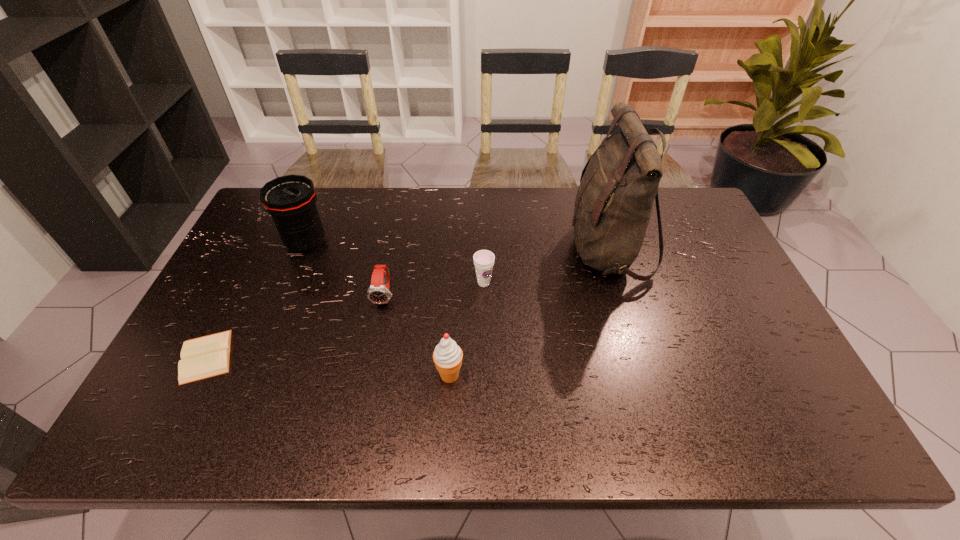
This screenshot has height=540, width=960. In order to click on unoccupied area between the cup and the tallest object in this screenshot , I will do `click(546, 267)`.

The image size is (960, 540). What are the coordinates of `vacant space in between the fourth shortest object and the third object from left to right` in the screenshot? It's located at (418, 335).

Identify the location of vacant space in between the fourth object from right to left and the fifth object from left to right. (435, 289).

The image size is (960, 540). Find the location of `vacant space in between the watch and the telephoto lens`. vacant space in between the watch and the telephoto lens is located at coordinates (346, 269).

Locate an element on the screen. empty space between the fourth object from left to right and the watch is located at coordinates (418, 335).

Image resolution: width=960 pixels, height=540 pixels. I want to click on the second closest object to the telephoto lens, so click(208, 356).

Choose which object is the third nearest neighbor to the shortest object. Please provide its 2D coordinates. Your answer should be formatted as a tuple, i.e. [(x, y)], where the tuple contains the x and y coordinates of a point satisfying the conditions above.

[(447, 356)]

You are a GUI agent. You are given a task and a screenshot of the screen. Output one action in this format:
    pyautogui.click(x=<x>, y=<y>)
    Task: Click on the vacant area that satisfies the following two spatial constraints: 1. on the back side of the fifth shortest object; 2. on the left side of the diary
    
    Given the screenshot: What is the action you would take?
    pyautogui.click(x=264, y=243)

Find the location of `blank area in the image that satisfies the following two spatial constraints: 1. on the open flap of the backpack; 2. on the face of the fourth object from right to left`. blank area in the image that satisfies the following two spatial constraints: 1. on the open flap of the backpack; 2. on the face of the fourth object from right to left is located at coordinates (621, 296).

Where is `vacant space that satisfies the following two spatial constraints: 1. on the open flap of the tallest object; 2. on the front side of the cup`? vacant space that satisfies the following two spatial constraints: 1. on the open flap of the tallest object; 2. on the front side of the cup is located at coordinates (617, 283).